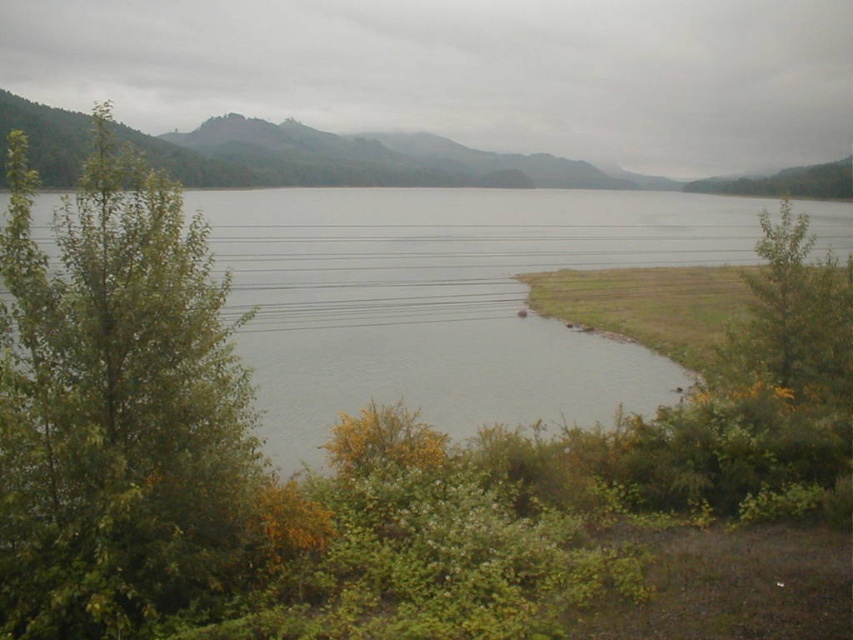
Is point (74, 442) positioned behind point (311, 432)?

No, it is in front of (311, 432).

Is point (73, 384) positioned in front of point (328, 337)?

Yes, point (73, 384) is in front of point (328, 337).

What do you see at coordinates (115, 406) in the screenshot?
I see `green leafy tree at left` at bounding box center [115, 406].

This screenshot has height=640, width=853. I want to click on green leafy tree at left, so click(x=115, y=406).